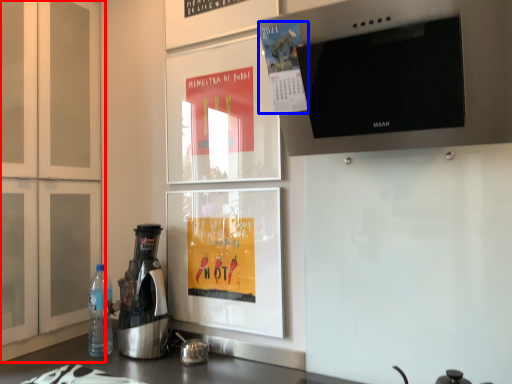
Question: Which of the following is the closest to the observer, cabinetry (highlighted by a red box) or poster (highlighted by a blue box)?

Choices:
 (A) cabinetry
 (B) poster

Answer: (B)